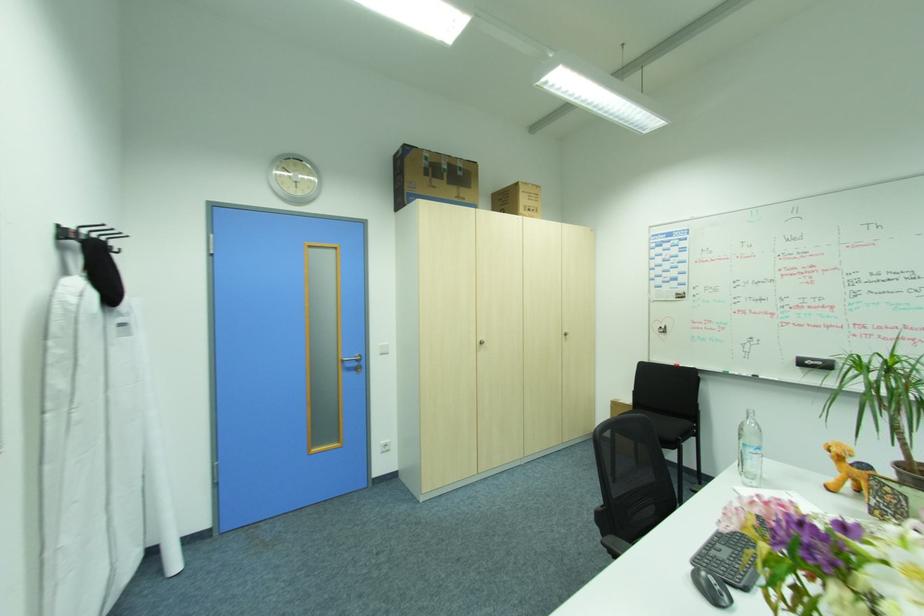
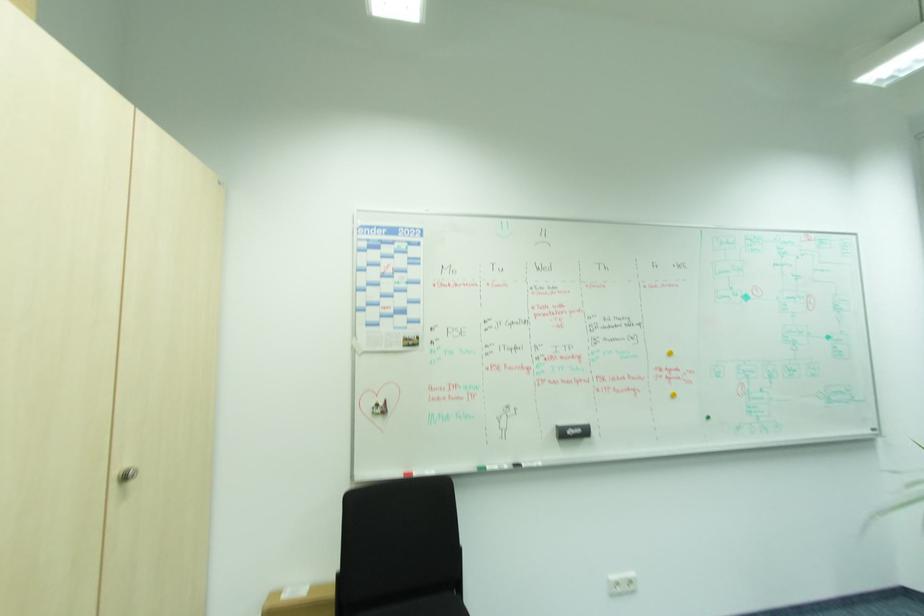
Where in the second image is the point corresponding to (732,374) from the first image?

(487, 471)